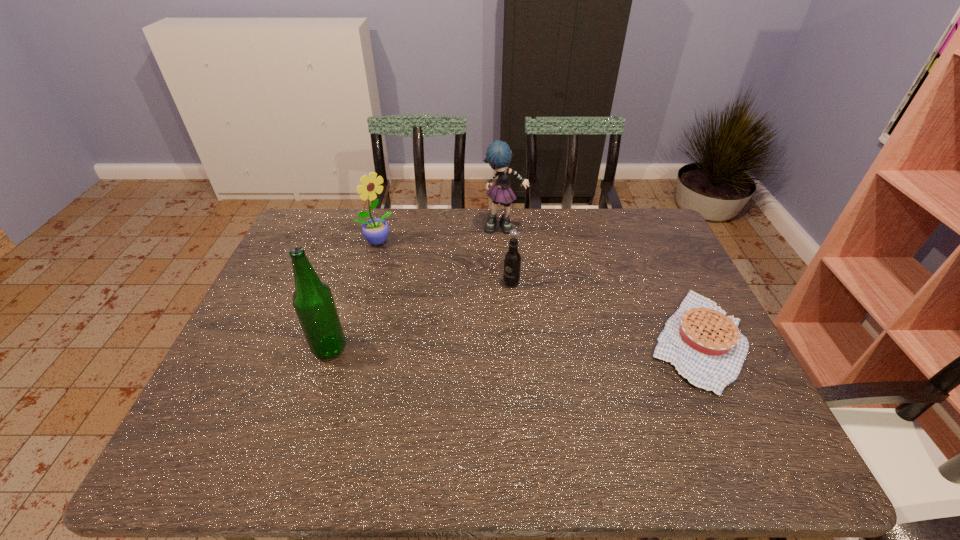
Locate an element on the screen. This screenshot has height=540, width=960. beer bottle is located at coordinates (313, 301).

Where is `the shortest object`? Image resolution: width=960 pixels, height=540 pixels. the shortest object is located at coordinates (706, 347).

You are a GUI agent. You are given a task and a screenshot of the screen. Output one action in this format:
    pyautogui.click(x=<x>, y=<y>)
    Task: Click on the pie
    
    Given the screenshot: What is the action you would take?
    pyautogui.click(x=706, y=347)

Identify the location of rag doll. The image size is (960, 540). (498, 155).

Locate an element on the screen. This screenshot has width=960, height=540. the third nearest object is located at coordinates (512, 260).

What are the coordinates of `root beer` in the screenshot? It's located at (512, 260).

Image resolution: width=960 pixels, height=540 pixels. What are the coordinates of `sunflower` in the screenshot? It's located at (375, 231).

Image resolution: width=960 pixels, height=540 pixels. I want to click on vacant space situated 0.080m on the label of the beer bottle, so click(280, 348).

This screenshot has height=540, width=960. Find the location of `free space located 0.110m on the label of the beer bottle`. free space located 0.110m on the label of the beer bottle is located at coordinates (269, 348).

Where is `vacant area situated on the back of the rightmost object`? This screenshot has height=540, width=960. vacant area situated on the back of the rightmost object is located at coordinates (657, 253).